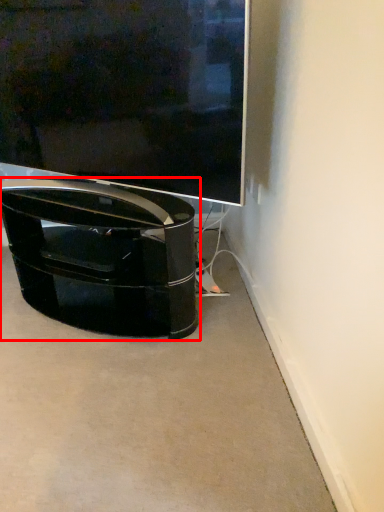
Question: Considering the relative positions of furniture (annotated by the red box) and television in the image provided, where is furniture (annotated by the red box) located with respect to the staircase?

Choices:
 (A) right
 (B) left

Answer: (B)